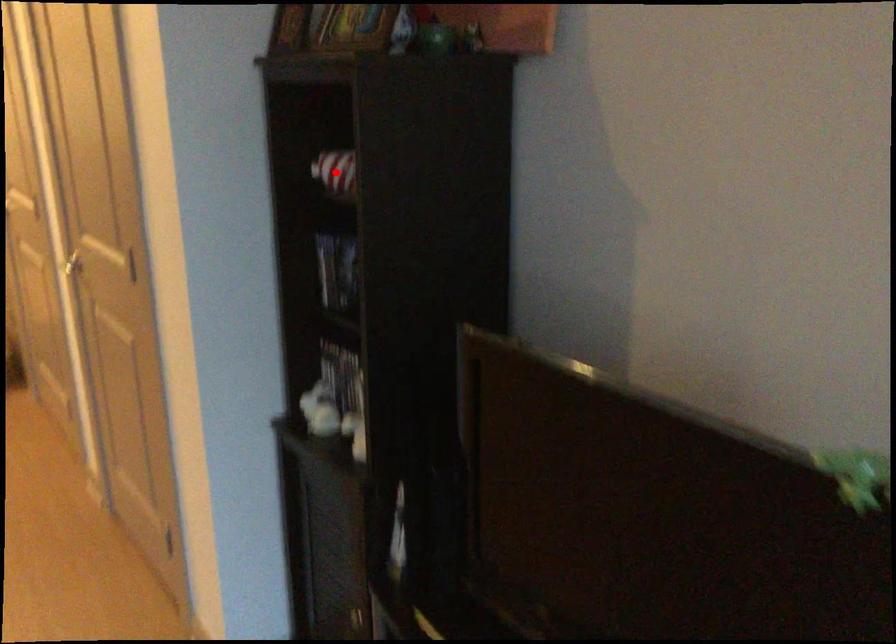
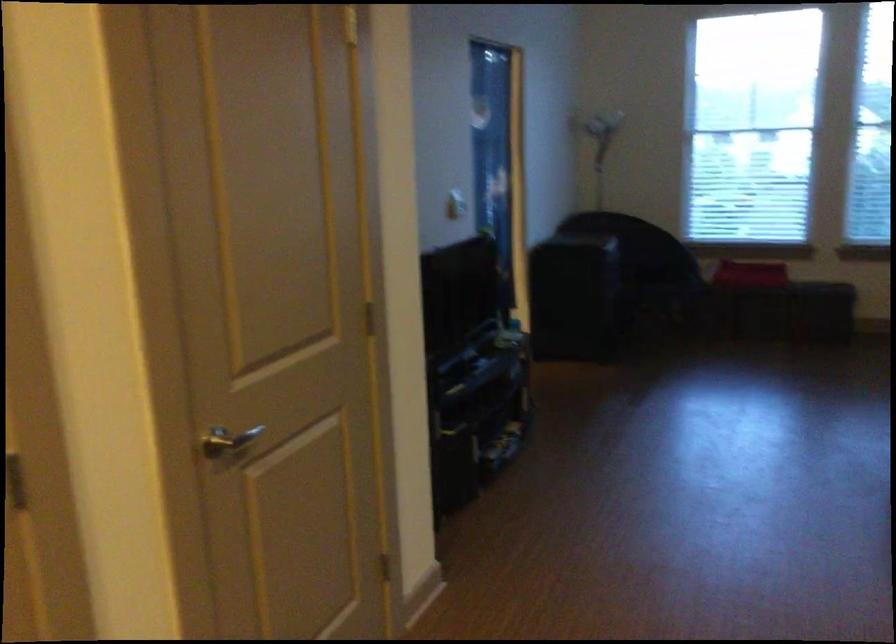
Question: I am providing you with two images of the same scene from different viewpoints. A red point is marked on the first image. Is the red point's position out of view in image 2?

Choices:
 (A) Yes
 (B) No

Answer: (A)